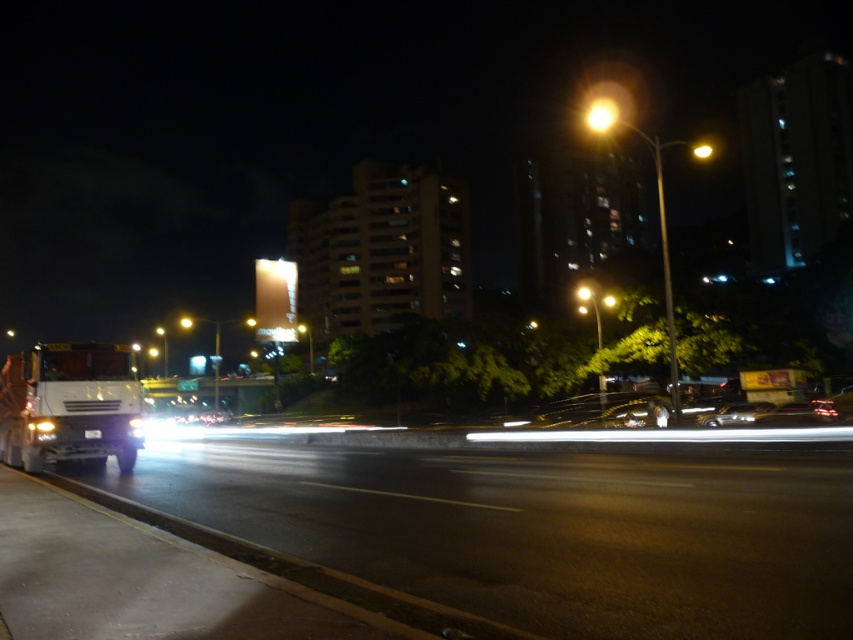
Question: Is the position of metallic silver trailer truck at left more distant than that of shiny silver car at center?

Choices:
 (A) yes
 (B) no

Answer: (B)

Question: Among these objects, which one is farthest from the camera?

Choices:
 (A) shiny silver car at center
 (B) metallic silver trailer truck at left

Answer: (A)

Question: Is metallic silver trailer truck at left wider than shiny silver car at center?

Choices:
 (A) no
 (B) yes

Answer: (A)

Question: Considering the relative positions of metallic silver trailer truck at left and shiny silver car at center in the image provided, where is metallic silver trailer truck at left located with respect to shiny silver car at center?

Choices:
 (A) right
 (B) left

Answer: (B)